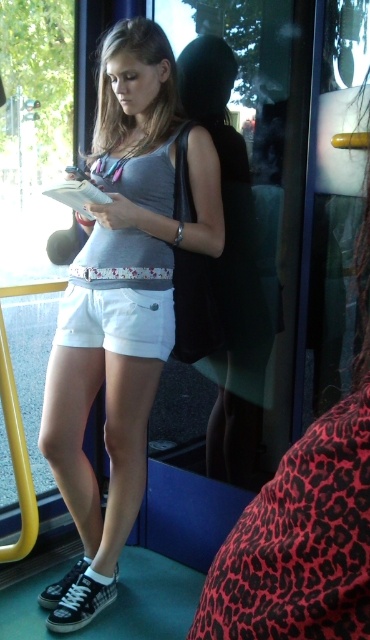
You are a fashion designer observing a woman wearing a matte gray tank top at center and a leopard print skirt at center. Which piece of clothing has a larger surface area?

The matte gray tank top at center has a larger surface area than the leopard print skirt at center.

You are a passenger on a bus and you see a woman wearing both a leopard print skirt at center and white cotton shorts at center. Which clothing item is closer to her feet?

The leopard print skirt at center is below the white cotton shorts at center, so the leopard print skirt at center is closer to her feet.

From the picture: You are a passenger on a bus and want to know if the point at coordinate (166,176) is behind the point at coordinate (360,612). Can you determine this based on their positions?

Yes, the point at coordinate (166,176) is behind the point at coordinate (360,612).